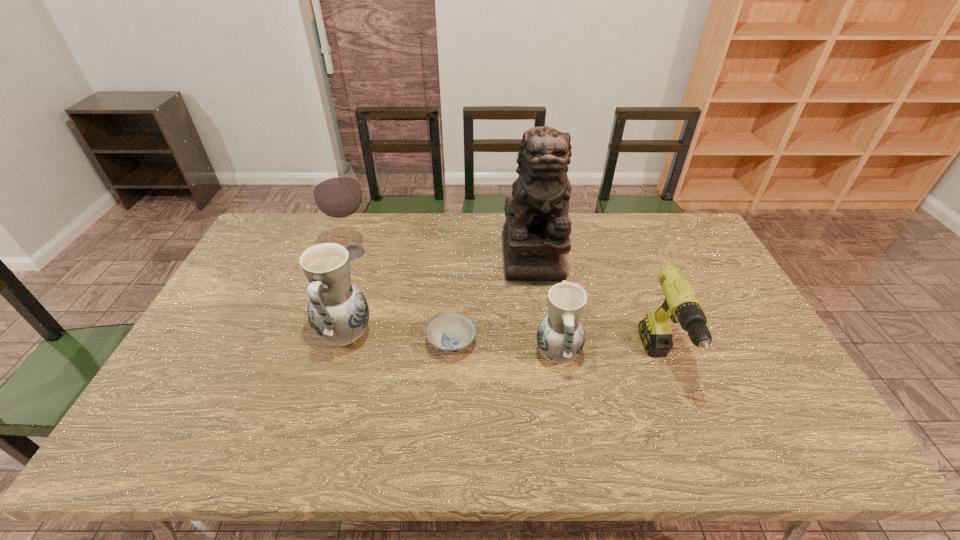
Image resolution: width=960 pixels, height=540 pixels. What are the coordinates of `vacant space situated on either side of the shorter pottery` in the screenshot? It's located at (691, 355).

At what (x,y) coordinates should I click in order to perform the action: click on vacant space located on the front of the alcohol. Please return your answer as a coordinate pair (x, y). The height and width of the screenshot is (540, 960). Looking at the image, I should click on (344, 279).

Identify the location of free space located on the front-facing side of the tallest object. This screenshot has height=540, width=960. (545, 338).

Find the location of `vacant space located on the back of the fourth object from right to left`. vacant space located on the back of the fourth object from right to left is located at coordinates (458, 241).

In order to click on alcohol that is at the far edge in this screenshot , I will do `click(337, 193)`.

Image resolution: width=960 pixels, height=540 pixels. In order to click on sculpture located in the far edge section of the desktop in this screenshot , I will do `click(536, 232)`.

Find the location of `object located at the near edge`. object located at the near edge is located at coordinates (681, 304).

Identify the location of vacant space at the far edge of the desktop. The image size is (960, 540). (476, 238).

In the image, there is a desktop. Where is `vacant space at the near edge`? vacant space at the near edge is located at coordinates (332, 406).

Locate an element on the screen. The image size is (960, 540). vacant space at the left edge is located at coordinates click(x=249, y=290).